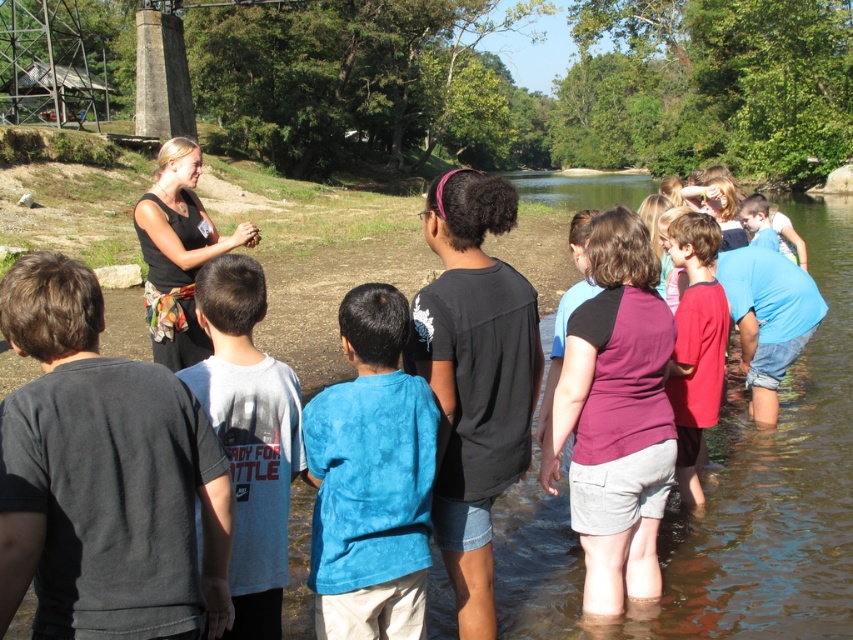
Question: Does clear water at center have a lesser width compared to dark gray cotton shirt at left?

Choices:
 (A) no
 (B) yes

Answer: (A)

Question: Considering the relative positions of white cotton shirt at center and red matte shirt at center in the image provided, where is white cotton shirt at center located with respect to red matte shirt at center?

Choices:
 (A) left
 (B) right

Answer: (A)

Question: Estimate the real-world distances between objects in this image. Which object is closer to the black matte shirt at center?

Choices:
 (A) clear water at center
 (B) black fabric shirt at center

Answer: (B)

Question: Does blue cotton shirt at center have a smaller size compared to purple cotton shirt at center?

Choices:
 (A) yes
 (B) no

Answer: (A)

Question: Which of these objects is positioned closest to the black fabric shirt at center?

Choices:
 (A) purple cotton shirt at center
 (B) white cotton shirt at center

Answer: (B)

Question: Which is nearer to the purple cotton shirt at center?

Choices:
 (A) white cotton shirt at center
 (B) dark gray cotton shirt at left
 (C) blue cotton shirt at center
 (D) red matte shirt at center

Answer: (D)